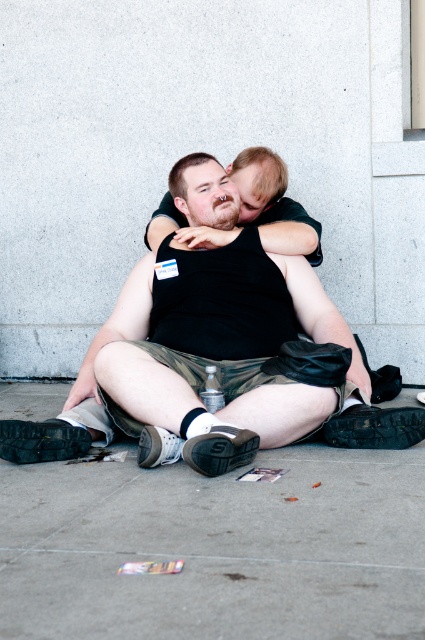
Is point (418, 515) farther from viewer compared to point (238, 230)?

That is False.

Does gray concrete pavement at lower center appear on the right side of smooth black shirt at center?

No, gray concrete pavement at lower center is not to the right of smooth black shirt at center.

Is point (189, 497) positioned in front of point (252, 177)?

Yes, point (189, 497) is in front of point (252, 177).

Locate an element on the screen. gray concrete pavement at lower center is located at coordinates (215, 548).

Who is more distant from viewer, (113, 339) or (308, 216)?

The point (308, 216) is more distant.

Does black matte tank top at center appear on the right side of smooth black shirt at center?

In fact, black matte tank top at center is to the left of smooth black shirt at center.

In order to click on black matte tank top at center in this screenshot , I will do `click(212, 348)`.

Between gray concrete pavement at lower center and black matte tank top at center, which one is positioned higher?

black matte tank top at center is above.

Identify the location of gray concrete pavement at lower center. (215, 548).

Identify the location of gray concrete pavement at lower center. (215, 548).